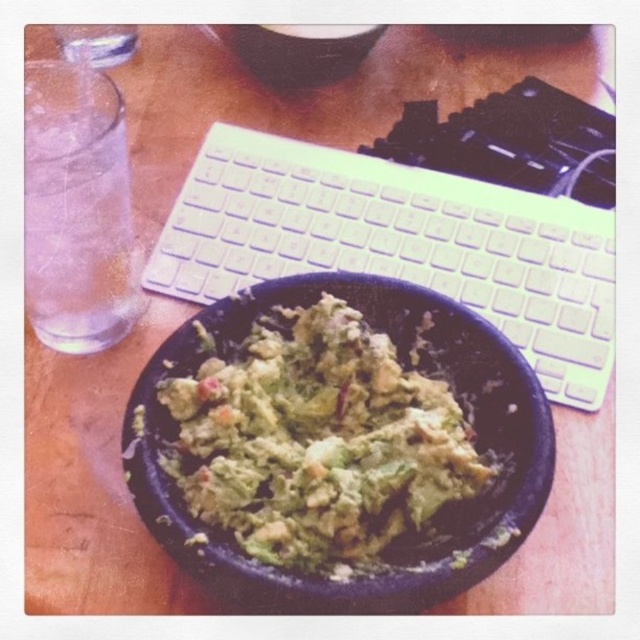
Based on the photo, you are looking at the table from above. There are two points marked on the table surface labeled as point [563,371] and point [424,408]. Which point is closer to you?

Point [424,408] is closer to you because it is in front of point [563,371].